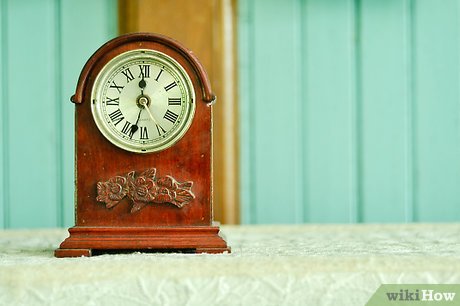
This screenshot has height=306, width=460. What are the coordinates of `white table cloth` in the screenshot? It's located at (232, 269).